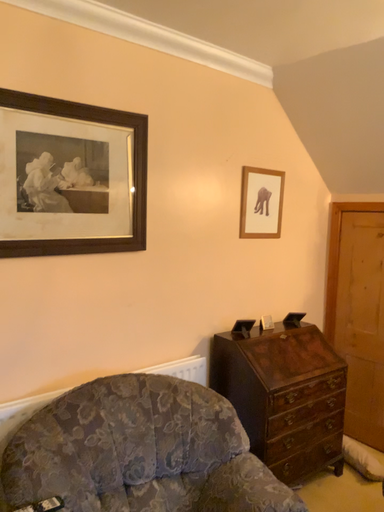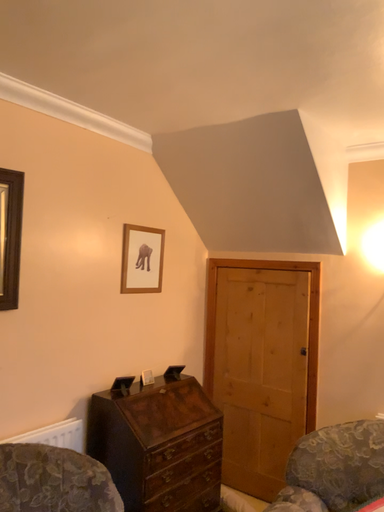
Question: Which way did the camera rotate in the video?

Choices:
 (A) rotated upward
 (B) rotated downward

Answer: (A)